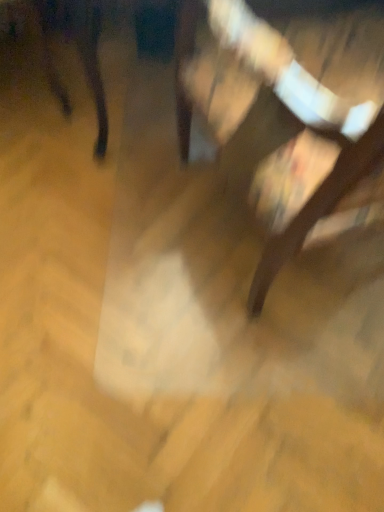
I want to click on wooden chair at center, so click(x=282, y=108).

The height and width of the screenshot is (512, 384). What do you see at coordinates (282, 108) in the screenshot?
I see `wooden chair at center` at bounding box center [282, 108].

Locate an element on the screen. wooden chair at center is located at coordinates (282, 108).